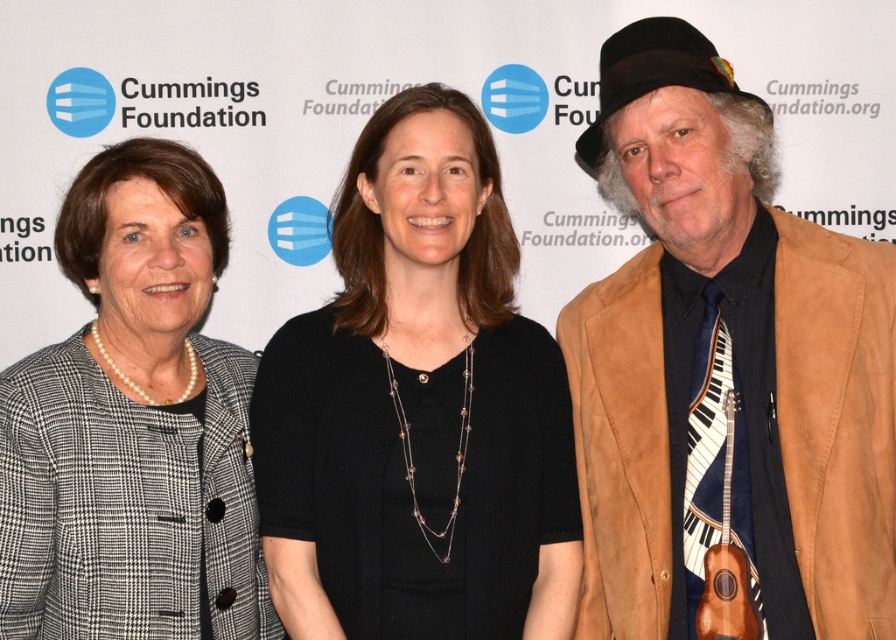
Which is behind, point (778, 605) or point (46, 577)?

The point (46, 577) is behind.

Can you confirm if suede jacket at center is taller than plaid wool blazer at left?

Correct, suede jacket at center is much taller as plaid wool blazer at left.

Is point (677, 330) behind point (197, 572)?

Yes.

This screenshot has width=896, height=640. I want to click on suede jacket at center, so click(725, 368).

Who is more forward, (325, 577) or (24, 529)?

Point (24, 529)

Is point (408, 428) in front of point (90, 161)?

That is True.

I want to click on black matte sweater at center, so click(418, 406).

Between point (743, 282) and point (265, 499), which one is positioned behind?

Point (265, 499)

How far apart are suede jacket at center and black matte sweater at center?

12.12 inches

Describe the element at coordinates (725, 368) in the screenshot. I see `suede jacket at center` at that location.

At what (x,y) coordinates should I click in order to perform the action: click on suede jacket at center. Please return your answer as a coordinate pair (x, y). This screenshot has width=896, height=640. Looking at the image, I should click on (725, 368).